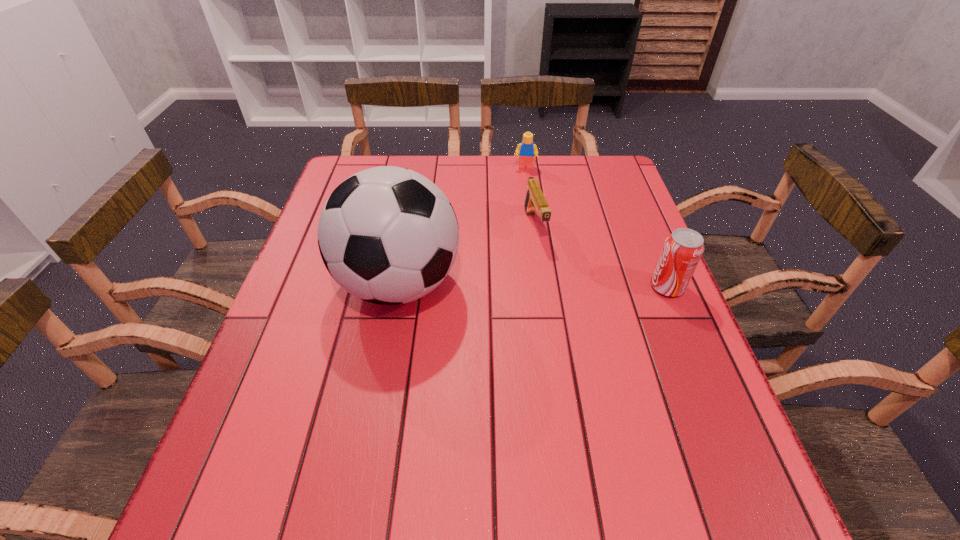
Locate an element on the screen. vacant space at the near edge of the desktop is located at coordinates (416, 427).

Locate an element on the screen. The height and width of the screenshot is (540, 960). vacant space at the right edge is located at coordinates (616, 211).

This screenshot has width=960, height=540. Find the location of `free space at the near left corner of the desktop`. free space at the near left corner of the desktop is located at coordinates (241, 414).

At what (x,y) coordinates should I click in order to perform the action: click on free location at the far right corner of the desktop. Please return your answer as a coordinate pair (x, y). This screenshot has height=540, width=960. Looking at the image, I should click on (608, 184).

Where is `vacant region at the near right corner`? This screenshot has height=540, width=960. vacant region at the near right corner is located at coordinates (703, 423).

The height and width of the screenshot is (540, 960). I want to click on vacant area that lies between the second tallest object and the leftmost object, so click(533, 286).

Locate an element on the screen. The width and height of the screenshot is (960, 540). vacant area between the rightmost object and the leftmost object is located at coordinates (533, 286).

Locate an element on the screen. The width and height of the screenshot is (960, 540). free space that is in between the leftmost object and the farthest object is located at coordinates (462, 226).

Where is `free spot between the rightmost object and the pistol`? The width and height of the screenshot is (960, 540). free spot between the rightmost object and the pistol is located at coordinates (601, 256).

You are a GUI agent. You are given a task and a screenshot of the screen. Output one action in this format:
    pyautogui.click(x=<x>, y=<y>)
    Task: Click on the vacant space in between the soccer ball and the pistol
    This screenshot has width=960, height=540.
    Given the screenshot: What is the action you would take?
    pyautogui.click(x=467, y=255)